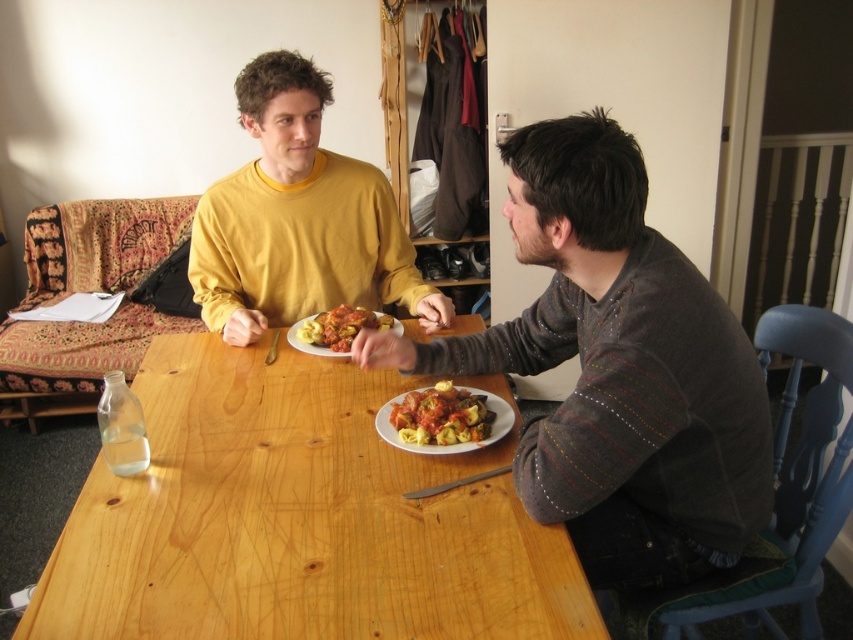
Describe the element at coordinates (297, 520) in the screenshot. Image resolution: width=853 pixels, height=640 pixels. I see `wooden table at center` at that location.

Who is more distant from viewer, (437, 618) or (549, 433)?

Positioned behind is point (549, 433).

Image resolution: width=853 pixels, height=640 pixels. I want to click on wooden table at center, so click(297, 520).

Find the location of a particular element. This screenshot has height=640, width=853. wooden table at center is located at coordinates (297, 520).

Who is positioned more to the right, matte yellow sweater at center or matte tortellini at center?

Positioned to the right is matte tortellini at center.

Consider the image. Is matte yellow sweater at center to the left of matte tortellini at center from the viewer's perspective?

Indeed, matte yellow sweater at center is positioned on the left side of matte tortellini at center.

In order to click on matte yellow sweater at center in this screenshot , I will do point(299,220).

Consider the image. Is wooden table at center shorter than matte tortellini at center?

No.

Does point (309, 385) come in front of point (402, 417)?

No.

Describe the element at coordinates (297, 520) in the screenshot. I see `wooden table at center` at that location.

Where is `wooden table at center`? wooden table at center is located at coordinates (297, 520).